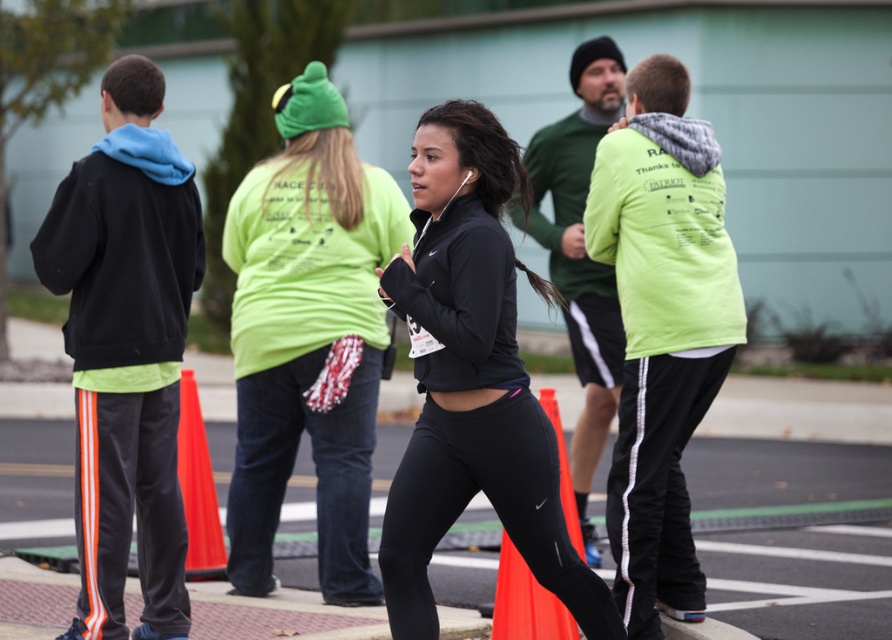
You are a photographer standing at the starting line of the race. You want to take a photo that includes both the matte black leggings at center and the neon green hoodie at upper right. Which object should you focus on first to ensure both are in the frame?

You should focus on the matte black leggings at center first since it is closer to the viewer, allowing the neon green hoodie at upper right to remain in the frame as well.

Looking at this image, you are a photographer trying to capture the central runner in the image. You need to focus on the matte black leggings at center and the black matte jacket at center. Which clothing item is located lower on the runner?

The matte black leggings at center is positioned under the black matte jacket at center, so the matte black leggings at center is lower on the runner.

You are a photographer trying to capture the matte black leggings at center and the neon green hoodie at upper right in the same frame. Based on their positions, which one should you adjust your camera to focus on first to ensure both are in the shot?

The matte black leggings at center is positioned on the left side of neon green hoodie at upper right. To capture both in the same frame, focus on the matte black leggings at center first since it is to the left of the neon green hoodie at upper right, allowing you to adjust the camera to include both from left to right.